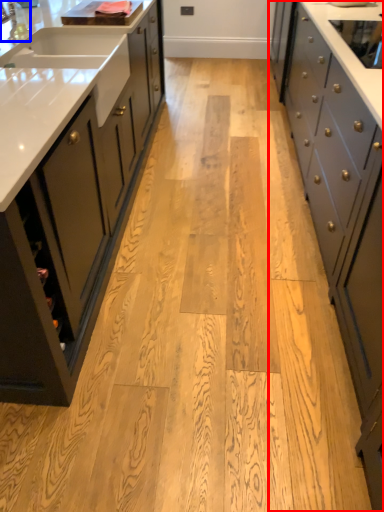
Question: Which object is closer to the camera taking this photo, cabinetry (highlighted by a red box) or faucet (highlighted by a blue box)?

Choices:
 (A) cabinetry
 (B) faucet

Answer: (A)